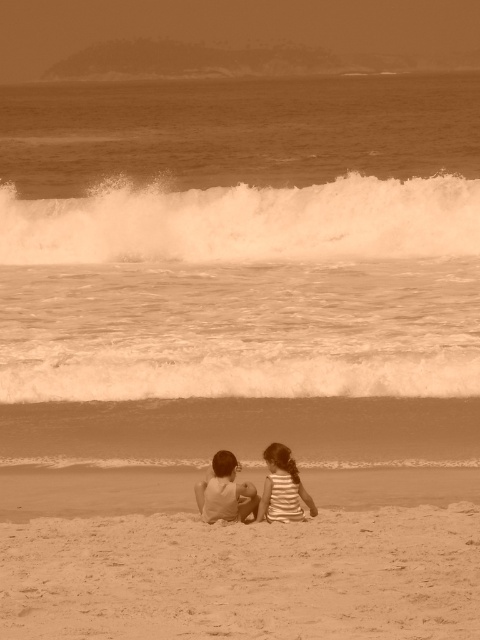
Question: Estimate the real-world distances between objects in this image. Which object is closer to the striped fabric child at lower center?

Choices:
 (A) striped fabric child at center
 (B) white foamy wave at upper center
 (C) fine-grained sand at lower center

Answer: (A)

Question: Which point appears closest to the camera in this image?

Choices:
 (A) (465, 560)
 (B) (204, 483)
 (C) (297, 188)

Answer: (A)

Question: Is fine-grained sand at lower center wider than striped fabric child at lower center?

Choices:
 (A) yes
 (B) no

Answer: (A)

Question: Which object is closer to the camera taking this photo?

Choices:
 (A) striped fabric child at lower center
 (B) fine-grained sand at lower center

Answer: (B)

Question: In this image, where is white foamy wave at upper center located relative to striped fabric child at lower center?

Choices:
 (A) left
 (B) right

Answer: (A)

Question: Can you confirm if white foamy wave at upper center is positioned above striped fabric child at center?

Choices:
 (A) yes
 (B) no

Answer: (A)